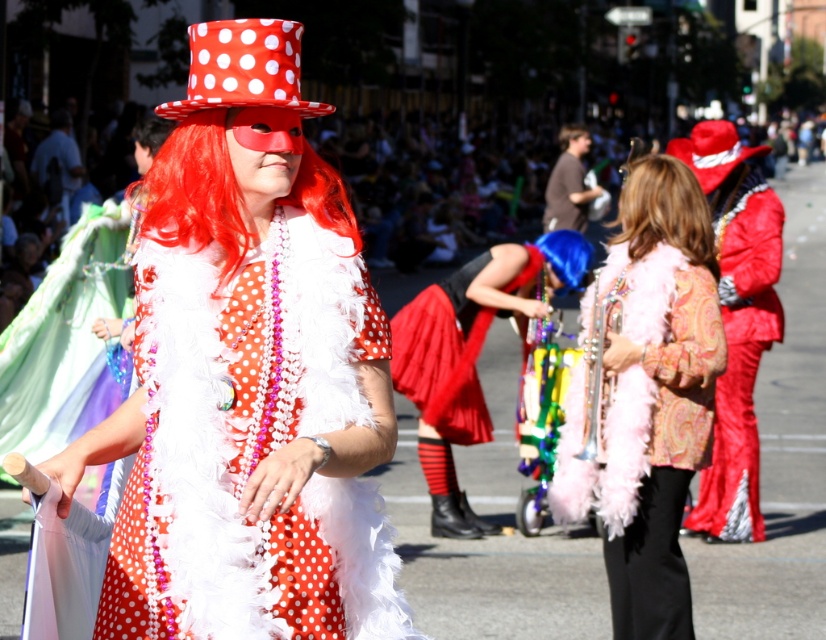
Question: Which of the following is the farthest from the observer?

Choices:
 (A) (642, 547)
 (B) (573, 131)
 (C) (737, 474)
 (D) (240, 104)

Answer: (B)

Question: Can you confirm if pink feather boa at center is bigger than shiny blue wig at center?

Choices:
 (A) no
 (B) yes

Answer: (A)

Question: Which object is positioned closest to the matte polka dot dress at center?

Choices:
 (A) pink feather boa at center
 (B) brown feather boa at center

Answer: (A)

Question: Does pink feather boa at center appear over red polka dot fabric hat at upper center?

Choices:
 (A) yes
 (B) no

Answer: (B)

Question: Does matte polka dot dress at center appear over pink feather boa at center?

Choices:
 (A) yes
 (B) no

Answer: (A)

Question: Which of the following is the farthest from the observer?

Choices:
 (A) matte brown shirt at center
 (B) shiny blue wig at center
 (C) red feather boa at center
 (D) red felt hat at center

Answer: (A)